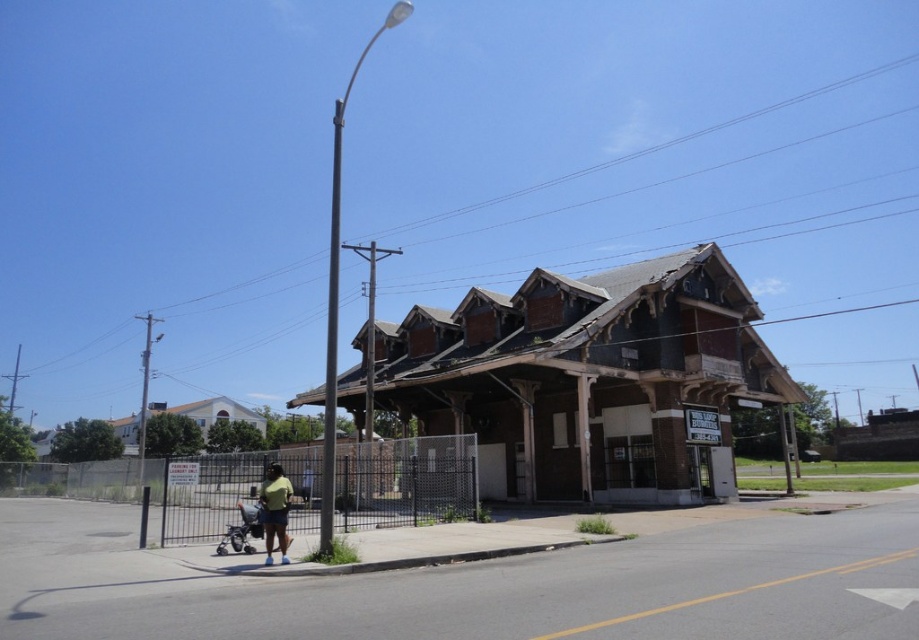
You are a delivery person trying to navigate through the sidewalk in front of the old building. You see a smooth gray pole at center and a green matte shirt at lower center. Which object is closer to the fence enclosing the parking lot?

The smooth gray pole at center is positioned on the left side of green matte shirt at lower center. Since the fence is enclosing the parking lot in front of the building, the smooth gray pole at center would be closer to the fence than the green matte shirt at lower center.

You are a delivery person trying to navigate through the sidewalk near the fenced area. You see a smooth gray pole at center and a green matte shirt at lower center. Which object would block your path more if you were to walk directly towards the building?

The smooth gray pole at center has a larger size compared to green matte shirt at lower center, so it would block your path more if you were to walk directly towards the building.

You are a delivery person trying to navigate through the sidewalk in front of the old building. You see the green matte shirt at lower center and the silver metallic stroller at lower left. Which object is closer to your eye level?

The green matte shirt at lower center is shorter than the silver metallic stroller at lower left, so the stroller is closer to your eye level.